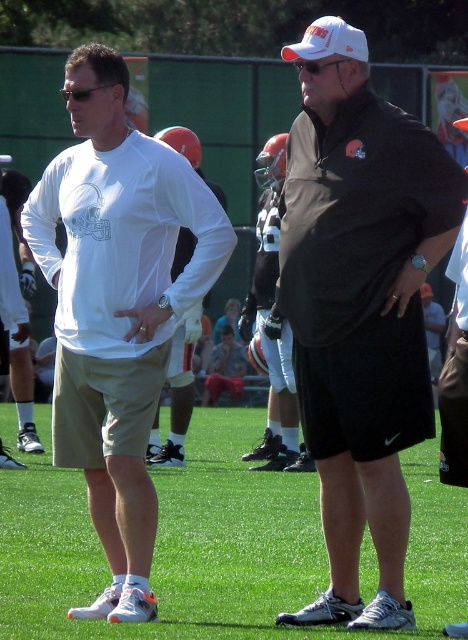
Question: Is matte black shirt at center bigger than matte white shirt at center?

Choices:
 (A) yes
 (B) no

Answer: (A)

Question: Is matte black shirt at center smaller than matte white shirt at center?

Choices:
 (A) no
 (B) yes

Answer: (A)

Question: Estimate the real-world distances between objects in this image. Which object is closer to the matte white shirt at center?

Choices:
 (A) green grass at center
 (B) white matte long-sleeve shirt at left
 (C) matte black shirt at center

Answer: (A)

Question: Which point is farther from the camera taking this photo?

Choices:
 (A) (338, 616)
 (B) (239, 476)

Answer: (B)

Question: Which is nearer to the matte white shirt at center?

Choices:
 (A) green grass at center
 (B) white matte long-sleeve shirt at left
 (C) matte black shirt at center

Answer: (A)

Question: In this image, where is green grass at center located relative to matte white shirt at center?

Choices:
 (A) right
 (B) left

Answer: (A)